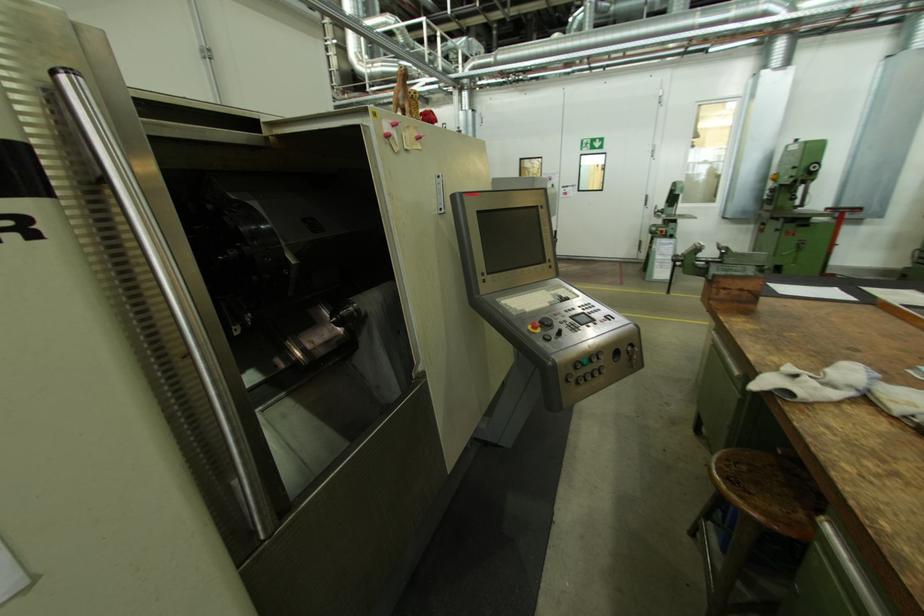
What do you see at coordinates (167, 286) in the screenshot? The width and height of the screenshot is (924, 616). I see `a long metal handle` at bounding box center [167, 286].